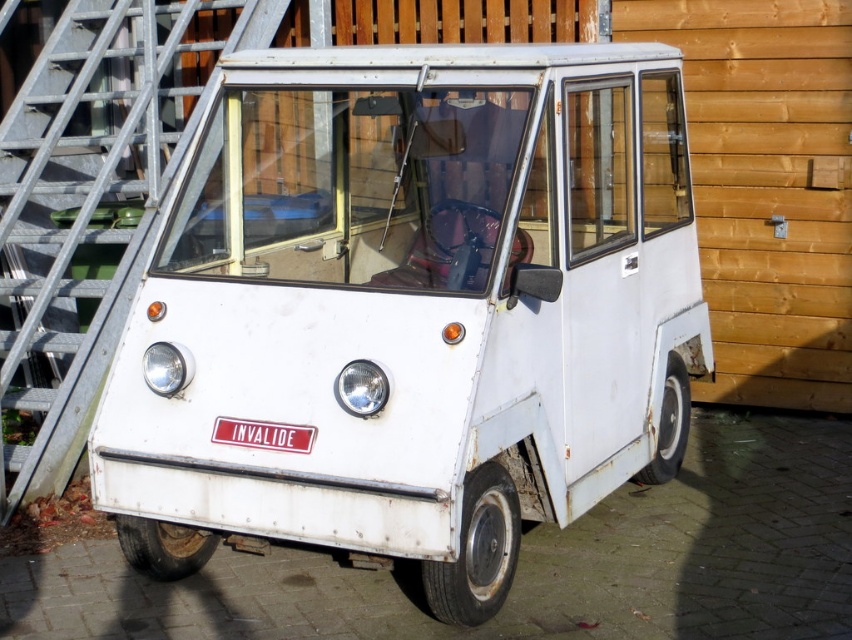
Question: Is white matte van at center bigger than red rubber license plate at center?

Choices:
 (A) yes
 (B) no

Answer: (A)

Question: Does white matte van at center have a greater width compared to red rubber license plate at center?

Choices:
 (A) no
 (B) yes

Answer: (B)

Question: Does white matte van at center lie in front of red rubber license plate at center?

Choices:
 (A) no
 (B) yes

Answer: (B)

Question: Which of the following is the closest to the observer?

Choices:
 (A) white matte van at center
 (B) red rubber license plate at center

Answer: (A)